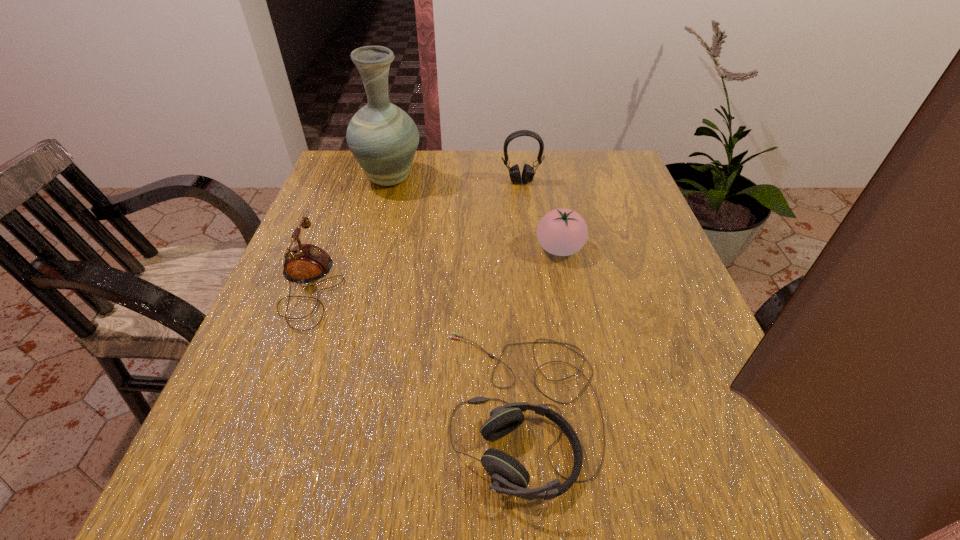
This screenshot has height=540, width=960. What are the coordinates of `vacant space situated on the rotary dial of the telephone` in the screenshot? It's located at (377, 286).

Identify the location of blank space located 0.110m on the outer surface of the nearer headset. The width and height of the screenshot is (960, 540). (372, 408).

Locate an element on the screen. blank space located on the outer surface of the nearer headset is located at coordinates (237, 408).

Identify the location of vacant space located 0.280m on the outer surface of the nearer headset. The width and height of the screenshot is (960, 540). (263, 408).

Where is `pitcher that is at the far edge`? The height and width of the screenshot is (540, 960). pitcher that is at the far edge is located at coordinates (383, 138).

The height and width of the screenshot is (540, 960). I want to click on headset that is at the far edge, so click(x=528, y=172).

Identify the location of object that is at the near edge. The image size is (960, 540). click(508, 476).

The width and height of the screenshot is (960, 540). I want to click on pitcher present at the left edge, so (x=383, y=138).

Locate an element on the screen. The height and width of the screenshot is (540, 960). telephone situated at the left edge is located at coordinates (304, 263).

Identify the location of object present at the far left corner. (383, 138).